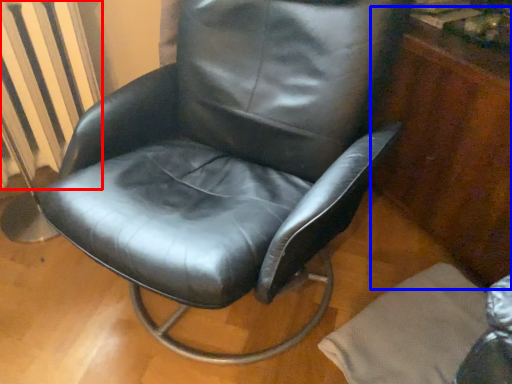
Question: Which object appears farthest to the camera in this image, radiator (highlighted by a red box) or dresser (highlighted by a blue box)?

Choices:
 (A) radiator
 (B) dresser

Answer: (A)